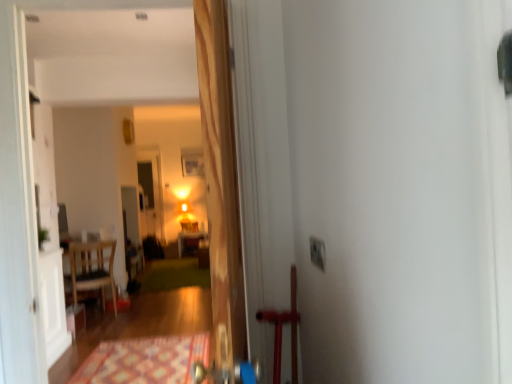
Question: Is wooden table at center positioned behind green carpet at center, positioned as the 1th doormat in back-to-front order?

Choices:
 (A) no
 (B) yes

Answer: (B)

Question: From the image's perspective, does wooden table at center appear lower than green carpet at center, which is the 2th doormat from front to back?

Choices:
 (A) no
 (B) yes

Answer: (A)

Question: From a real-world perspective, is wooden table at center located higher than green carpet at center, which is the 2th doormat from front to back?

Choices:
 (A) no
 (B) yes

Answer: (B)

Question: Can you confirm if wooden table at center is shorter than green carpet at center, positioned as the 1th doormat in back-to-front order?

Choices:
 (A) yes
 (B) no

Answer: (B)

Question: Considering the relative positions of wooden table at center and green carpet at center, positioned as the 1th doormat in back-to-front order, in the image provided, is wooden table at center to the right of green carpet at center, positioned as the 1th doormat in back-to-front order, from the viewer's perspective?

Choices:
 (A) no
 (B) yes

Answer: (B)

Question: Does wooden table at center have a greater height compared to green carpet at center, positioned as the 1th doormat in back-to-front order?

Choices:
 (A) no
 (B) yes

Answer: (B)

Question: Considering the relative sizes of wooden door at center and patterned carpet at lower center, which appears as the first doormat when viewed from the front, in the image provided, is wooden door at center taller than patterned carpet at lower center, which appears as the first doormat when viewed from the front,?

Choices:
 (A) no
 (B) yes

Answer: (B)

Question: Does wooden door at center touch patterned carpet at lower center, which appears as the first doormat when viewed from the front?

Choices:
 (A) no
 (B) yes

Answer: (A)

Question: Considering the relative sizes of wooden door at center and patterned carpet at lower center, which ranks as the 2th doormat in back-to-front order, in the image provided, is wooden door at center bigger than patterned carpet at lower center, which ranks as the 2th doormat in back-to-front order,?

Choices:
 (A) yes
 (B) no

Answer: (A)

Question: Is wooden door at center outside patterned carpet at lower center, which appears as the first doormat when viewed from the front?

Choices:
 (A) yes
 (B) no

Answer: (A)

Question: From a real-world perspective, is wooden door at center located beneath patterned carpet at lower center, which ranks as the 2th doormat in back-to-front order?

Choices:
 (A) yes
 (B) no

Answer: (B)

Question: Is wooden door at center to the right of patterned carpet at lower center, which appears as the first doormat when viewed from the front, from the viewer's perspective?

Choices:
 (A) yes
 (B) no

Answer: (A)

Question: Does wooden chair at left have a greater width compared to white plastic electric outlet at upper right?

Choices:
 (A) yes
 (B) no

Answer: (A)